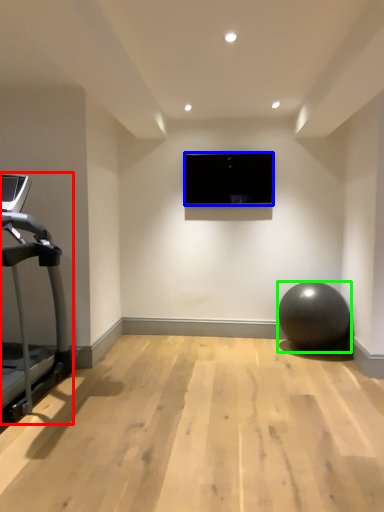
Question: Which is farther away from treadmill (highlighted by a red box)? computer screen (highlighted by a blue box) or ball (highlighted by a green box)?

Choices:
 (A) computer screen
 (B) ball

Answer: (B)